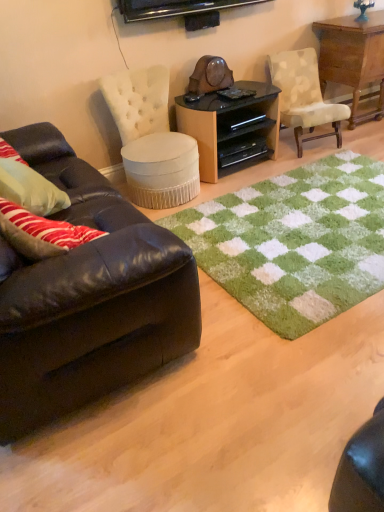
I want to click on black plastic drawer at center, arranged as the second drawer when viewed from the top, so click(x=241, y=151).

What do you see at coordinates (88, 298) in the screenshot?
I see `shiny brown leather couch at left` at bounding box center [88, 298].

Where is `green shaggy rug at center`? green shaggy rug at center is located at coordinates coord(294,242).

Describe the element at coordinates (242, 120) in the screenshot. I see `black plastic drawer at center, which is the 2th drawer in bottom-to-top order` at that location.

Describe the element at coordinates (230, 127) in the screenshot. I see `black glossy wood desk at center` at that location.

Where is `black plastic drawer at center, the 1th drawer positioned from the bottom`? This screenshot has height=512, width=384. black plastic drawer at center, the 1th drawer positioned from the bottom is located at coordinates (241, 151).

Is black plastic drawer at center, which is the 2th drawer in bottom-to-top order, not near beige fabric chair at upper right, which ranks as the 2th chair in left-to-right order?

black plastic drawer at center, which is the 2th drawer in bottom-to-top order, is actually quite close to beige fabric chair at upper right, which ranks as the 2th chair in left-to-right order.

Find the location of a particular element. the 2nd drawer behind the beige fabric chair at upper right, which is the 1th chair in right-to-left order, starting your count from the anchor is located at coordinates (242, 120).

Based on the photo, is black plastic drawer at center, which is the 2th drawer in bottom-to-top order, shorter than beige fabric chair at upper right, which is the 1th chair in right-to-left order?

Correct, black plastic drawer at center, which is the 2th drawer in bottom-to-top order, is not as tall as beige fabric chair at upper right, which is the 1th chair in right-to-left order.

In the scene shown: Considering the relative sizes of black plastic drawer at center, which is the 2th drawer in bottom-to-top order, and beige fabric chair at upper right, which is the 1th chair in right-to-left order, in the image provided, is black plastic drawer at center, which is the 2th drawer in bottom-to-top order, wider than beige fabric chair at upper right, which is the 1th chair in right-to-left order,?

No.

Considering the sizes of beige fabric chair at upper right, which is the 1th chair in right-to-left order, and white tufted fabric ottoman at center, the first chair positioned from the left, in the image, is beige fabric chair at upper right, which is the 1th chair in right-to-left order, taller or shorter than white tufted fabric ottoman at center, the first chair positioned from the left,?

In the image, beige fabric chair at upper right, which is the 1th chair in right-to-left order, appears to be shorter than white tufted fabric ottoman at center, the first chair positioned from the left.

Looking at the image, does beige fabric chair at upper right, which ranks as the 2th chair in left-to-right order, seem bigger or smaller compared to white tufted fabric ottoman at center, which ranks as the second chair in right-to-left order?

Considering their sizes, beige fabric chair at upper right, which ranks as the 2th chair in left-to-right order, takes up less space than white tufted fabric ottoman at center, which ranks as the second chair in right-to-left order.

In terms of width, does beige fabric chair at upper right, which is the 1th chair in right-to-left order, look wider or thinner when compared to white tufted fabric ottoman at center, which ranks as the second chair in right-to-left order?

Considering their sizes, beige fabric chair at upper right, which is the 1th chair in right-to-left order, looks slimmer than white tufted fabric ottoman at center, which ranks as the second chair in right-to-left order.

From a real-world perspective, is beige fabric chair at upper right, which ranks as the 2th chair in left-to-right order, located higher than white tufted fabric ottoman at center, which ranks as the second chair in right-to-left order?

No, from a real-world perspective, beige fabric chair at upper right, which ranks as the 2th chair in left-to-right order, is not above white tufted fabric ottoman at center, which ranks as the second chair in right-to-left order.

Does black glossy wood desk at center contain wooden table at upper right?

No, wooden table at upper right is not inside black glossy wood desk at center.

From a real-world perspective, is black glossy wood desk at center positioned over wooden table at upper right based on gravity?

No, from a real-world perspective, black glossy wood desk at center is not above wooden table at upper right.

Does black glossy wood desk at center have a greater height compared to wooden table at upper right?

No, black glossy wood desk at center is not taller than wooden table at upper right.

Consider the image. Is wooden table at upper right facing away from green shaggy rug at center?

No, wooden table at upper right is not facing the opposite direction of green shaggy rug at center.

Which object is closer to the camera, wooden table at upper right or green shaggy rug at center?

green shaggy rug at center is closer to the camera.

In the scene shown: Does wooden table at upper right contain green shaggy rug at center?

No, wooden table at upper right does not contain green shaggy rug at center.

Is point (41, 160) behind point (184, 116)?

No, it is not.

Based on the photo, does shiny brown leather couch at left have a larger size compared to black glossy wood desk at center?

Correct, shiny brown leather couch at left is larger in size than black glossy wood desk at center.

Is shiny brown leather couch at left at the right side of black glossy wood desk at center?

No, shiny brown leather couch at left is not to the right of black glossy wood desk at center.

Is shiny brown leather couch at left wider or thinner than black plastic drawer at center, which is the 1th drawer from top to bottom?

Clearly, shiny brown leather couch at left has more width compared to black plastic drawer at center, which is the 1th drawer from top to bottom.

From a real-world perspective, who is located higher, shiny brown leather couch at left or black plastic drawer at center, which is the 1th drawer from top to bottom?

shiny brown leather couch at left, from a real-world perspective.

From the picture: Considering the positions of objects shiny brown leather couch at left and black plastic drawer at center, which is the 1th drawer from top to bottom, in the image provided, who is more to the right, shiny brown leather couch at left or black plastic drawer at center, which is the 1th drawer from top to bottom,?

From the viewer's perspective, black plastic drawer at center, which is the 1th drawer from top to bottom, appears more on the right side.

Is point (226, 101) closer or farther from the camera than point (99, 313)?

Point (226, 101).

Who is shorter, black glossy wood desk at center or shiny brown leather couch at left?

Standing shorter between the two is black glossy wood desk at center.

Is black glossy wood desk at center facing towards shiny brown leather couch at left?

No, black glossy wood desk at center is not aimed at shiny brown leather couch at left.

Starting from the black plastic drawer at center, which is the 1th drawer from top to bottom, which chair is the 1st one in front? Please provide its 2D coordinates.

[(304, 96)]

Find the location of a particular element. The image size is (384, 512). chair beneath the white tufted fabric ottoman at center, the first chair positioned from the left (from a real-world perspective) is located at coordinates (304, 96).

When comparing their distances from beige fabric chair at upper right, which ranks as the 2th chair in left-to-right order, does shiny brown leather couch at left or green shaggy rug at center seem further?

shiny brown leather couch at left is further to beige fabric chair at upper right, which ranks as the 2th chair in left-to-right order.

Which object lies further to the anchor point wooden table at upper right, green shaggy rug at center or black glossy wood desk at center?

Among the two, green shaggy rug at center is located further to wooden table at upper right.

Based on their spatial positions, is white tufted fabric ottoman at center, which ranks as the second chair in right-to-left order, or beige fabric chair at upper right, which ranks as the 2th chair in left-to-right order, closer to wooden table at upper right?

beige fabric chair at upper right, which ranks as the 2th chair in left-to-right order, lies closer to wooden table at upper right than the other object.

From the image, which object appears to be nearer to black plastic drawer at center, the 1th drawer positioned from the bottom, wooden table at upper right or green shaggy rug at center?

Based on the image, green shaggy rug at center appears to be nearer to black plastic drawer at center, the 1th drawer positioned from the bottom.

In the scene shown: Looking at the image, which one is located closer to black glossy wood desk at center, shiny brown leather couch at left or green shaggy rug at center?

green shaggy rug at center is positioned closer to the anchor black glossy wood desk at center.

From the image, which object appears to be nearer to black plastic drawer at center, which is the 1th drawer from top to bottom, white tufted fabric ottoman at center, which ranks as the second chair in right-to-left order, or black plastic drawer at center, arranged as the second drawer when viewed from the top?

Among the two, black plastic drawer at center, arranged as the second drawer when viewed from the top, is located nearer to black plastic drawer at center, which is the 1th drawer from top to bottom.

Based on their spatial positions, is beige fabric chair at upper right, which is the 1th chair in right-to-left order, or wooden table at upper right closer to black plastic drawer at center, which is the 2th drawer in bottom-to-top order?

beige fabric chair at upper right, which is the 1th chair in right-to-left order, is closer to black plastic drawer at center, which is the 2th drawer in bottom-to-top order.

Based on the photo, estimate the real-world distances between objects in this image. Which object is closer to shiny brown leather couch at left, wooden table at upper right or black glossy wood desk at center?

Among the two, black glossy wood desk at center is located nearer to shiny brown leather couch at left.

Where is `desk between white tufted fabric ottoman at center, the first chair positioned from the left, and beige fabric chair at upper right, which is the 1th chair in right-to-left order`? desk between white tufted fabric ottoman at center, the first chair positioned from the left, and beige fabric chair at upper right, which is the 1th chair in right-to-left order is located at coordinates (230, 127).

At what (x,y) coordinates should I click in order to perform the action: click on desk located between shiny brown leather couch at left and wooden table at upper right in the depth direction. Please return your answer as a coordinate pair (x, y). Looking at the image, I should click on (230, 127).

Locate an element on the screen. Image resolution: width=384 pixels, height=512 pixels. chair between shiny brown leather couch at left and beige fabric chair at upper right, which is the 1th chair in right-to-left order, from front to back is located at coordinates (151, 139).

You are a GUI agent. You are given a task and a screenshot of the screen. Output one action in this format:
    pyautogui.click(x=<x>, y=<y>)
    Task: Click on the desk between white tufted fabric ottoman at center, which ranks as the second chair in right-to-left order, and wooden table at upper right, in the horizontal direction
    The image size is (384, 512).
    Given the screenshot: What is the action you would take?
    pyautogui.click(x=230, y=127)